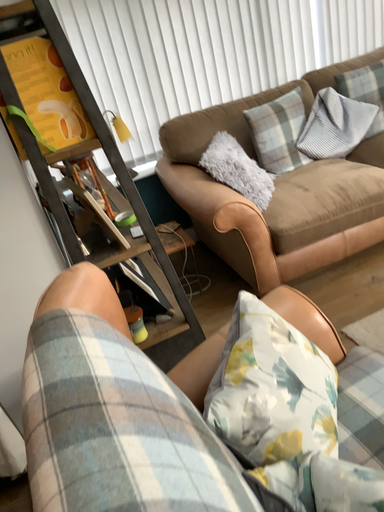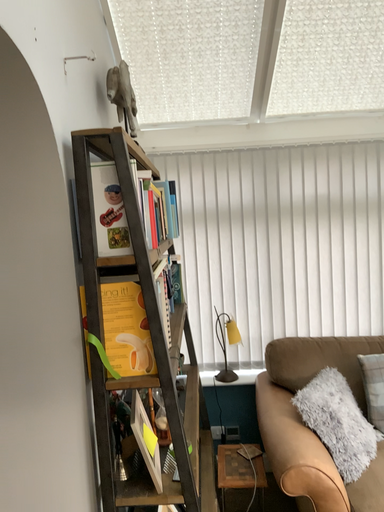
Question: Which way did the camera rotate in the video?

Choices:
 (A) rotated upward
 (B) rotated downward

Answer: (A)